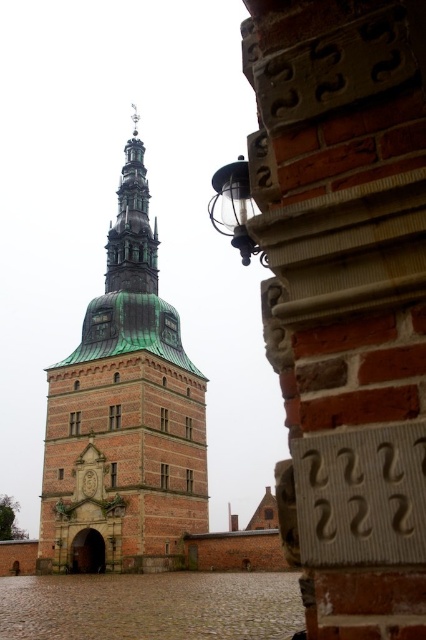
You are an architect reviewing the design plans for a historic building. The design includes a brown brick tower at center and a green copper bell tower at upper center. Based on the provided measurements, which tower is wider?

The brown brick tower at center is wider than the green copper bell tower at upper center according to the description.

You are an architect inspecting the historic building. You notice the brown brick tower at center and the green copper bell tower at upper center. Which of these two structures is closer to you from your current viewpoint?

The brown brick tower at center is closer to you because it is positioned in front of the green copper bell tower at upper center.